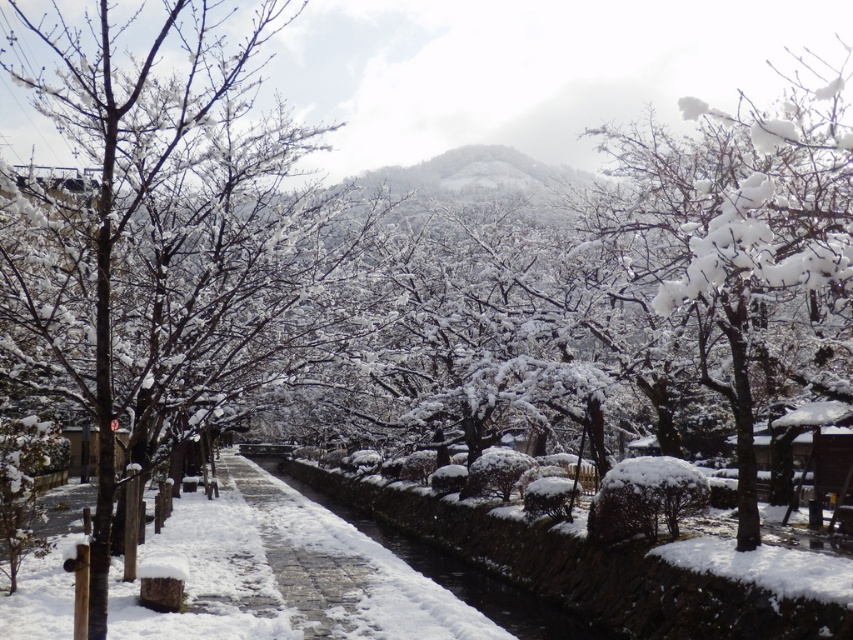
Question: Does snow-covered branches at center appear on the right side of snow-covered stone waterway at center?

Choices:
 (A) yes
 (B) no

Answer: (B)

Question: Which point appears closest to the camera in this image?

Choices:
 (A) (228, 336)
 (B) (549, 602)

Answer: (A)

Question: Which point appears farthest from the camera in this image?

Choices:
 (A) (207, 380)
 (B) (498, 604)

Answer: (B)

Question: Which object appears farthest from the camera in this image?

Choices:
 (A) snow-covered stone waterway at center
 (B) snow-covered branches at center

Answer: (A)

Question: Can you confirm if snow-covered branches at center is positioned above snow-covered stone waterway at center?

Choices:
 (A) no
 (B) yes

Answer: (B)

Question: Does snow-covered branches at center appear on the left side of snow-covered stone waterway at center?

Choices:
 (A) no
 (B) yes

Answer: (B)